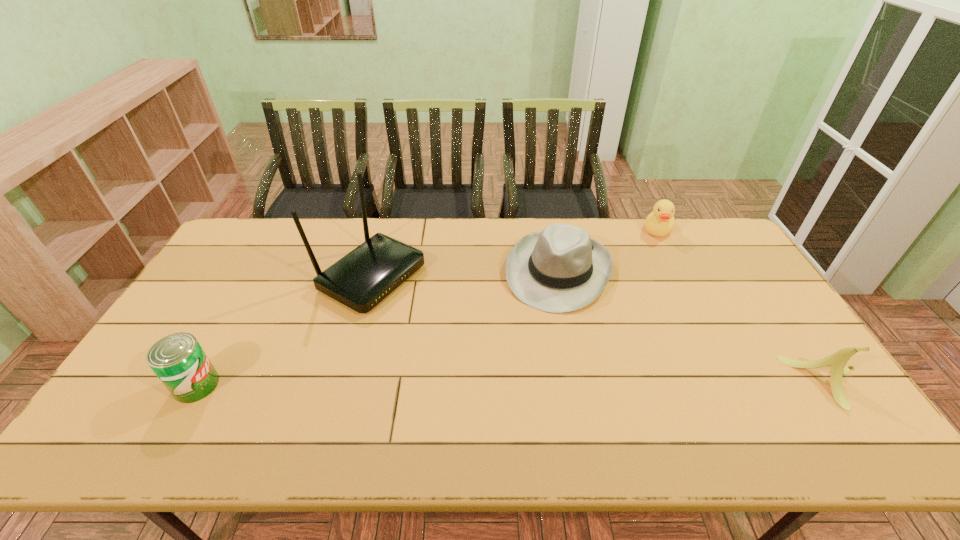
The image size is (960, 540). I want to click on can at the near edge, so click(178, 360).

I want to click on banana present at the near edge, so click(x=838, y=360).

Find the location of a particular element. The height and width of the screenshot is (540, 960). object at the left edge is located at coordinates (178, 360).

This screenshot has width=960, height=540. Find the location of `object that is at the right edge`. object that is at the right edge is located at coordinates pos(838,360).

The height and width of the screenshot is (540, 960). I want to click on object at the near left corner, so click(x=178, y=360).

Locate an element on the screen. object that is positioned at the near right corner is located at coordinates (838, 360).

The width and height of the screenshot is (960, 540). I want to click on free location at the far edge, so click(641, 247).

This screenshot has width=960, height=540. What are the coordinates of `free space at the near edge of the desktop` in the screenshot? It's located at (295, 410).

Find the location of a particular element. The height and width of the screenshot is (540, 960). vacant region at the left edge is located at coordinates (164, 334).

In the image, there is a desktop. At what (x,y) coordinates should I click in order to perform the action: click on vacant region at the right edge. Please return your answer as a coordinate pair (x, y). Looking at the image, I should click on (798, 346).